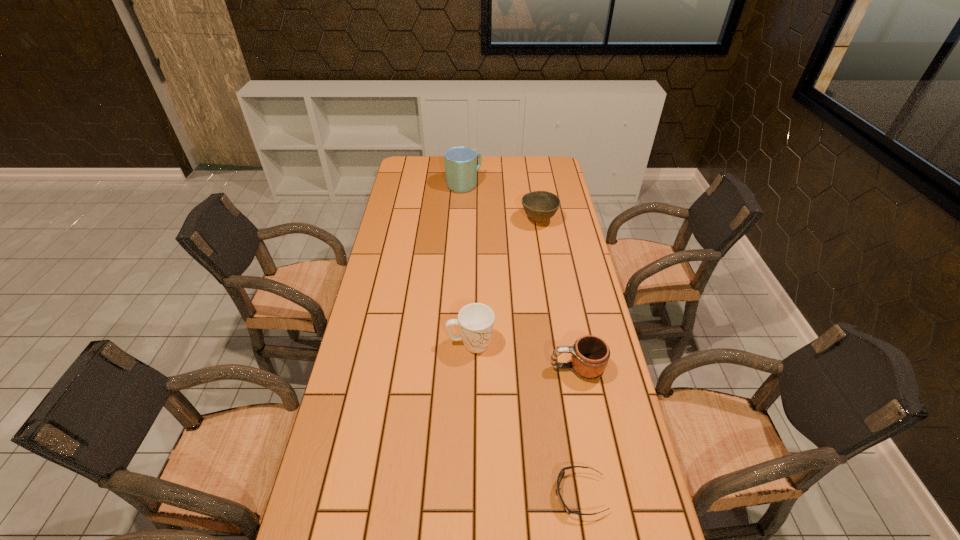
Where is `free space at the far edge`? free space at the far edge is located at coordinates (486, 164).

In the image, there is a desktop. Where is `free space at the left edge`? free space at the left edge is located at coordinates (401, 222).

At what (x,y) coordinates should I click in order to perform the action: click on vacant region at the right edge of the desktop. Please return your answer as a coordinate pair (x, y). This screenshot has width=960, height=540. Looking at the image, I should click on (602, 375).

Locate an element on the screen. Image resolution: width=960 pixels, height=540 pixels. vacant space at the far left corner of the desktop is located at coordinates (424, 172).

Find the location of `empty space between the fourth shortest object and the bowl`. empty space between the fourth shortest object and the bowl is located at coordinates (505, 282).

This screenshot has width=960, height=540. Find the location of `free space between the goggles and the fourth shortest object`. free space between the goggles and the fourth shortest object is located at coordinates pos(525,419).

The image size is (960, 540). Identify the location of empty location between the shortest mug and the goggles. (578, 431).

I want to click on vacant point located between the goggles and the tallest object, so click(x=522, y=340).

The image size is (960, 540). Find the location of `free space between the second tallest object and the tallest mug`. free space between the second tallest object and the tallest mug is located at coordinates (468, 264).

Identify the location of free space between the fourth shortest object and the shortest mug. The height and width of the screenshot is (540, 960). (523, 356).